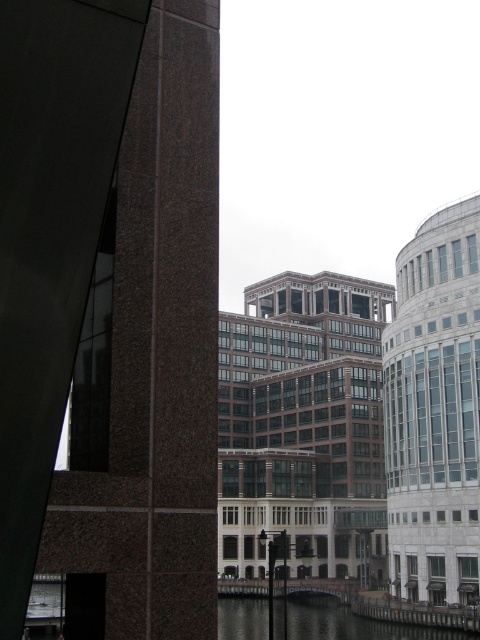
You are standing at the edge of a city park and see the brown stone tower at left and the clear water at lower center. Which object is higher from the ground level?

The brown stone tower at left is located above clear water at lower center, so it is higher from the ground level than the clear water at lower center.

You are an architect designing a new building in this urban area. You want to ensure that your building will not block the view of the brown stone tower at left from the clear water at lower center. Based on their widths, is this possible?

The brown stone tower at left has a lesser width compared to clear water at lower center. Since the tower is narrower, it is possible to design the new building so that it does not block the view of the tower from the water by ensuring the building does not extend beyond the tower or water areas.